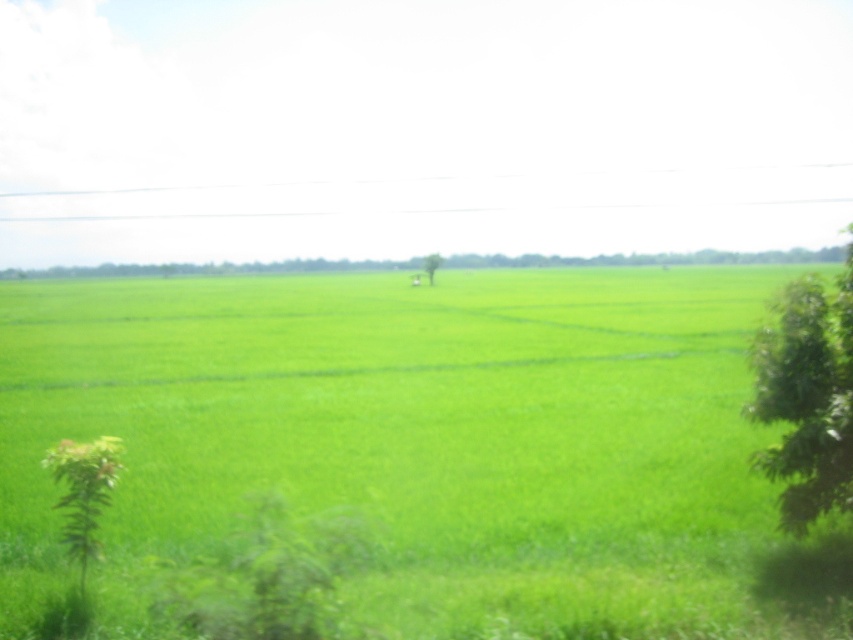
Is green leafy tree at right to the right of green leafy tree at center from the viewer's perspective?

Correct, you'll find green leafy tree at right to the right of green leafy tree at center.

Between green leafy tree at right and green leafy tree at center, which one is positioned lower?

green leafy tree at right

Between point (846, 284) and point (431, 276), which one is positioned in front?

Point (846, 284)

This screenshot has height=640, width=853. I want to click on green leafy tree at right, so click(x=807, y=397).

Based on the photo, can you confirm if green grass at center is bigger than green leafy tree at center?

Indeed, green grass at center has a larger size compared to green leafy tree at center.

Does point (572, 509) come farther from viewer compared to point (428, 266)?

No, (572, 509) is closer to viewer.

Who is more distant from viewer, (347, 362) or (426, 264)?

Positioned behind is point (426, 264).

I want to click on green grass at center, so click(410, 433).

Does green grass at center have a smaller size compared to green leafy tree at right?

No.

Is point (200, 349) positioned in front of point (799, 346)?

No.

Locate an element on the screen. green grass at center is located at coordinates (410, 433).